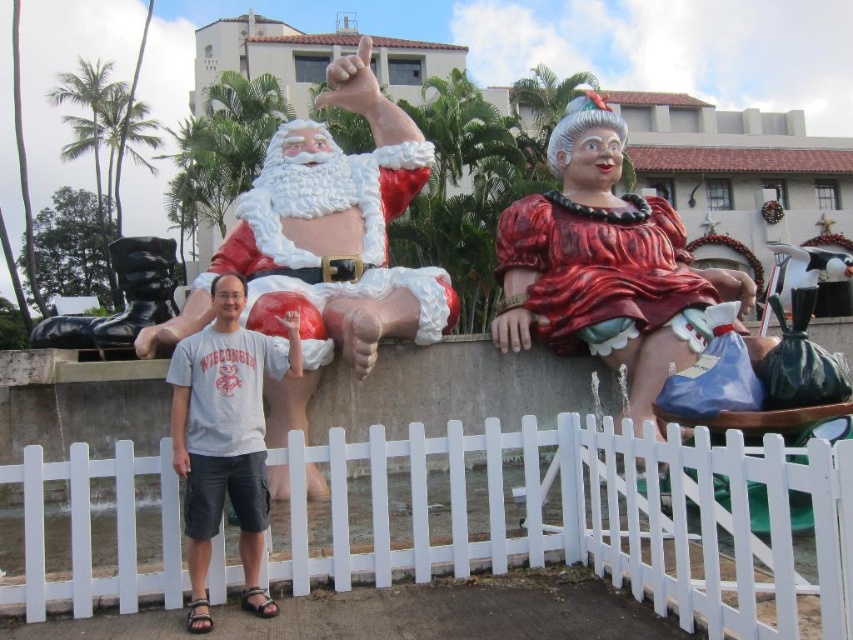
Question: Does white plastic picket fence at lower center come behind gray cotton t-shirt at center?

Choices:
 (A) no
 (B) yes

Answer: (A)

Question: From the image, what is the correct spatial relationship of white plastic picket fence at lower center in relation to gray cotton t-shirt at center?

Choices:
 (A) below
 (B) above

Answer: (A)

Question: Which of the following is the farthest from the observer?

Choices:
 (A) (252, 433)
 (B) (289, 189)

Answer: (B)

Question: Does matte plastic santa at upper center have a larger size compared to gray cotton t-shirt at center?

Choices:
 (A) no
 (B) yes

Answer: (B)

Question: Which point is farther to the camera?

Choices:
 (A) (347, 77)
 (B) (271, 614)

Answer: (A)

Question: Which point is farther from the camera taking this photo?

Choices:
 (A) (247, 374)
 (B) (425, 320)

Answer: (B)